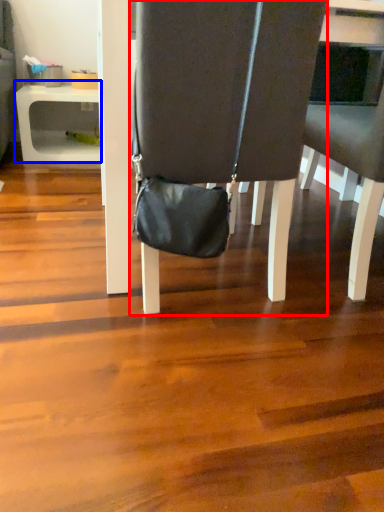
Question: Which object is closer to the camera taking this photo, chair (highlighted by a red box) or table (highlighted by a blue box)?

Choices:
 (A) chair
 (B) table

Answer: (A)